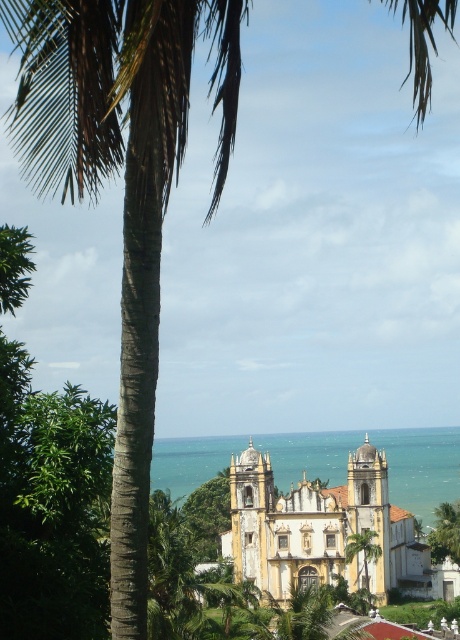
Question: Can you confirm if yellow matte church at center is smaller than blue water at center?

Choices:
 (A) no
 (B) yes

Answer: (A)

Question: Which object is closer to the camera taking this photo?

Choices:
 (A) blue water at center
 (B) yellow matte church at center

Answer: (B)

Question: Does yellow matte church at center appear under blue water at center?

Choices:
 (A) no
 (B) yes

Answer: (B)

Question: Which of the following is the closest to the observer?

Choices:
 (A) (332, 528)
 (B) (409, 436)

Answer: (A)

Question: Which point is farther to the camera?

Choices:
 (A) (446, 470)
 (B) (356, 536)

Answer: (A)

Question: Can you confirm if yellow matte church at center is smaller than blue water at center?

Choices:
 (A) no
 (B) yes

Answer: (A)